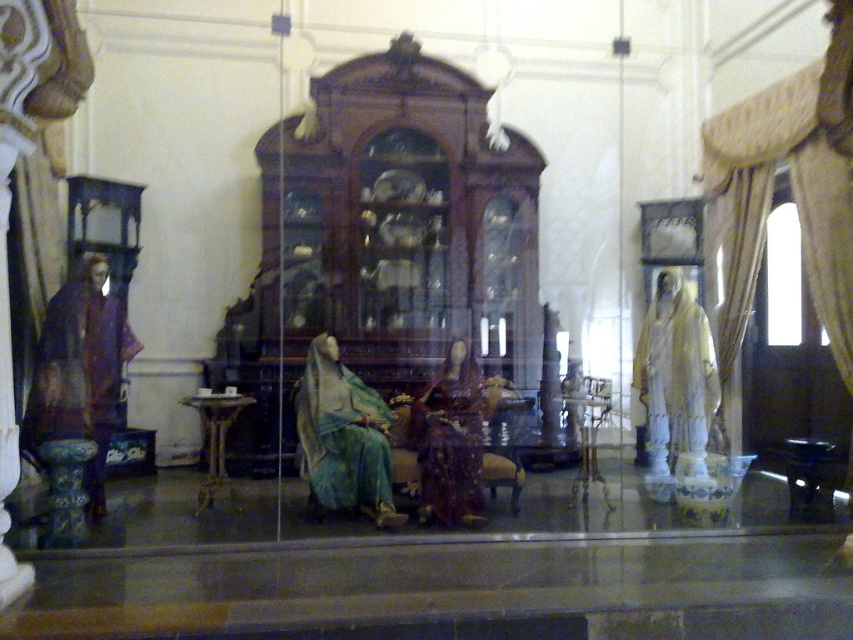
Who is positioned more to the left, matte green fabric at center or white marble statue at right?

Positioned to the left is matte green fabric at center.

Can you confirm if matte green fabric at center is smaller than white marble statue at right?

No.

Find the location of a particular element. matte green fabric at center is located at coordinates (343, 436).

Is matte brown fabric at center positioned at the back of wooden pedestal table at center?

No, it is not.

Is matte brown fabric at center thinner than wooden pedestal table at center?

No.

What do you see at coordinates (450, 440) in the screenshot?
I see `matte brown fabric at center` at bounding box center [450, 440].

Where is `matte brown fabric at center`? matte brown fabric at center is located at coordinates (450, 440).

Which is above, matte green fabric at center or wooden pedestal table at center?

matte green fabric at center is higher up.

Is point (337, 461) positioned before point (216, 490)?

Yes, point (337, 461) is closer to viewer.

I want to click on matte green fabric at center, so click(x=343, y=436).